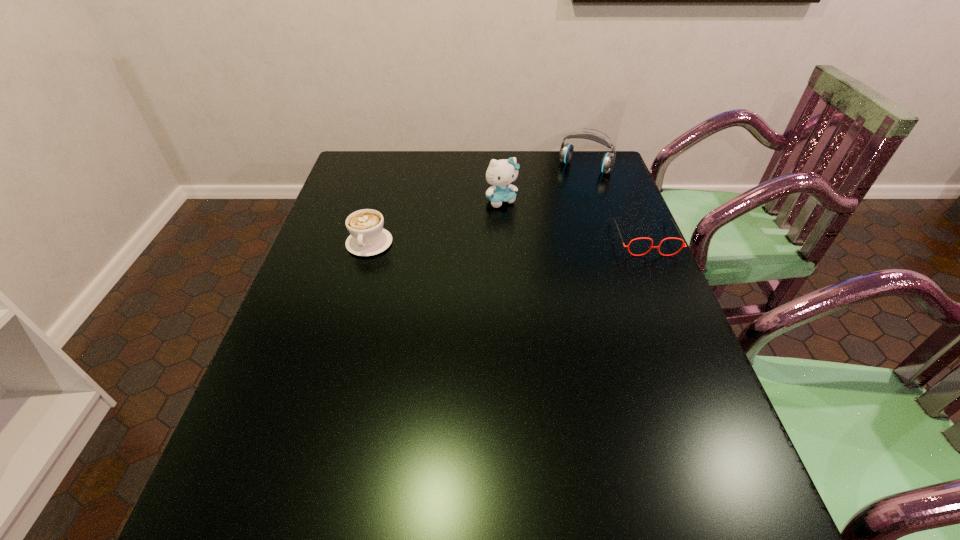
This screenshot has width=960, height=540. What are the coordinates of `the leftmost object` in the screenshot? It's located at (368, 237).

This screenshot has width=960, height=540. I want to click on cappuccino, so click(368, 237).

At what (x,y) coordinates should I click in order to perform the action: click on spectacles. Please return your answer as a coordinate pair (x, y). This screenshot has width=960, height=540. Looking at the image, I should click on tap(658, 247).

The image size is (960, 540). What are the coordinates of `the second farthest object` in the screenshot? It's located at (500, 173).

Where is `the second object from left to right`? This screenshot has width=960, height=540. the second object from left to right is located at coordinates (500, 173).

This screenshot has width=960, height=540. In order to click on headset in this screenshot , I will do `click(566, 151)`.

You are a GUI agent. You are given a task and a screenshot of the screen. Output one action in this format:
    pyautogui.click(x=<x>, y=<y>)
    Task: Click on the free space located 0.100m to the right of the cappuccino's handle
    
    Given the screenshot: What is the action you would take?
    coord(357,286)

What are the coordinates of `free spot located on the front-facing side of the shortest object` in the screenshot? It's located at (674, 308).

Locate an element on the screen. Image resolution: width=960 pixels, height=540 pixels. vacant area situated 0.170m on the face of the kitten is located at coordinates (536, 242).

Where is `free spot located on the face of the kitten`? This screenshot has height=540, width=960. free spot located on the face of the kitten is located at coordinates (534, 240).